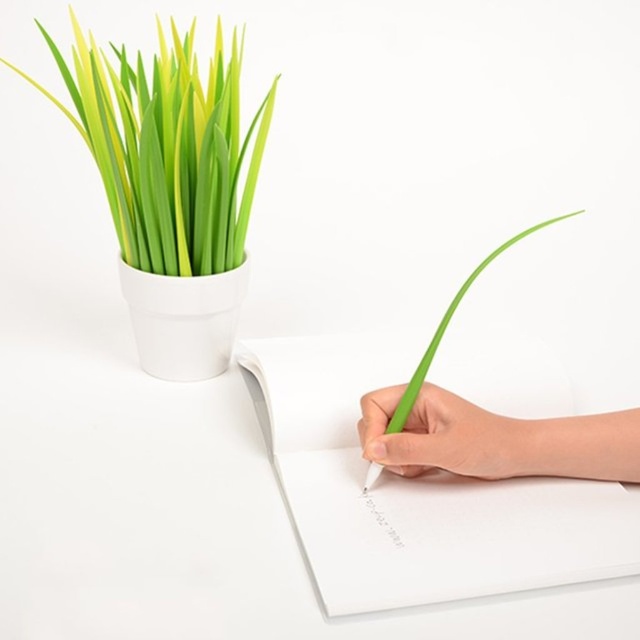
Consider the image. Can you confirm if white paper at center is positioned to the right of green matte grass at upper left?

Indeed, white paper at center is positioned on the right side of green matte grass at upper left.

From the picture: Does white paper at center have a greater height compared to green matte grass at upper left?

Incorrect, white paper at center's height is not larger of green matte grass at upper left's.

Is point (484, 388) positioned behind point (122, 161)?

No, (484, 388) is closer to viewer.

The image size is (640, 640). I want to click on white paper at center, so click(x=413, y=492).

Does green matte grass at upper left come in front of green matte pen at lower right?

Yes, green matte grass at upper left is closer to the viewer.

Between point (129, 225) and point (380, 456), which one is positioned behind?

The point (129, 225) is behind.

Which is in front, point (200, 243) or point (442, 456)?

Point (442, 456) is in front.

Find the location of a particular element. This screenshot has width=640, height=640. green matte grass at upper left is located at coordinates (166, 148).

Does white paper at center have a smaller size compared to green matte pen at lower right?

Answer: Actually, white paper at center might be larger than green matte pen at lower right.

Is white paper at center to the left of green matte pen at lower right from the viewer's perspective?

Correct, you'll find white paper at center to the left of green matte pen at lower right.

What do you see at coordinates (413, 492) in the screenshot?
I see `white paper at center` at bounding box center [413, 492].

At what (x,y) coordinates should I click in order to perform the action: click on white paper at center. Please return your answer as a coordinate pair (x, y). Looking at the image, I should click on (413, 492).